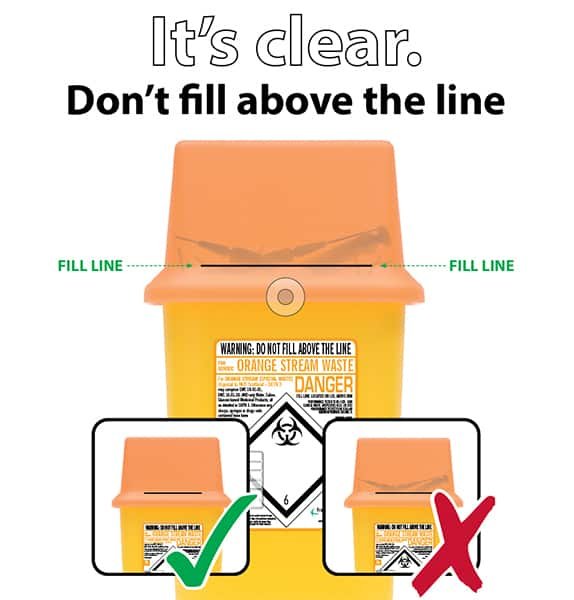
This screenshot has height=600, width=574. In order to click on yellow rectangular body of trash can in this screenshot , I will do `click(373, 338)`.